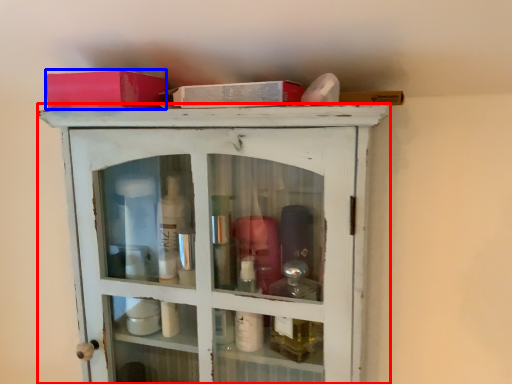
Question: Among these objects, which one is nearest to the camera, cupboard (highlighted by a red box) or box (highlighted by a blue box)?

Choices:
 (A) cupboard
 (B) box

Answer: (A)